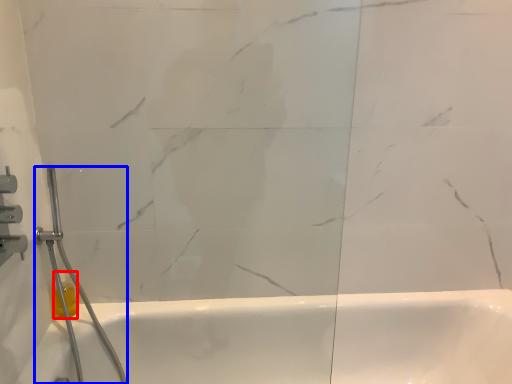
Question: Which point is closer to the camera, toiletry (highlighted by a red box) or shower (highlighted by a blue box)?

Choices:
 (A) toiletry
 (B) shower

Answer: (B)